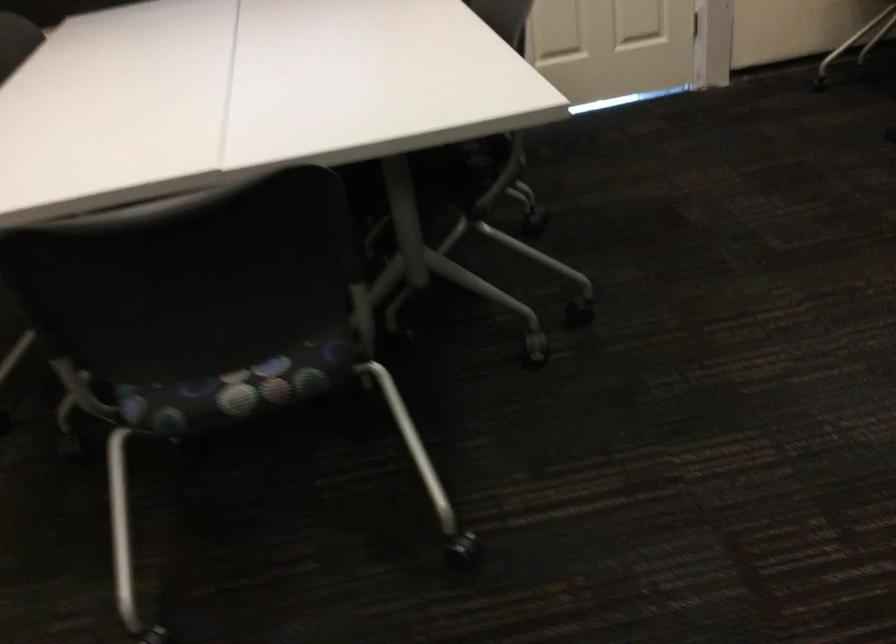
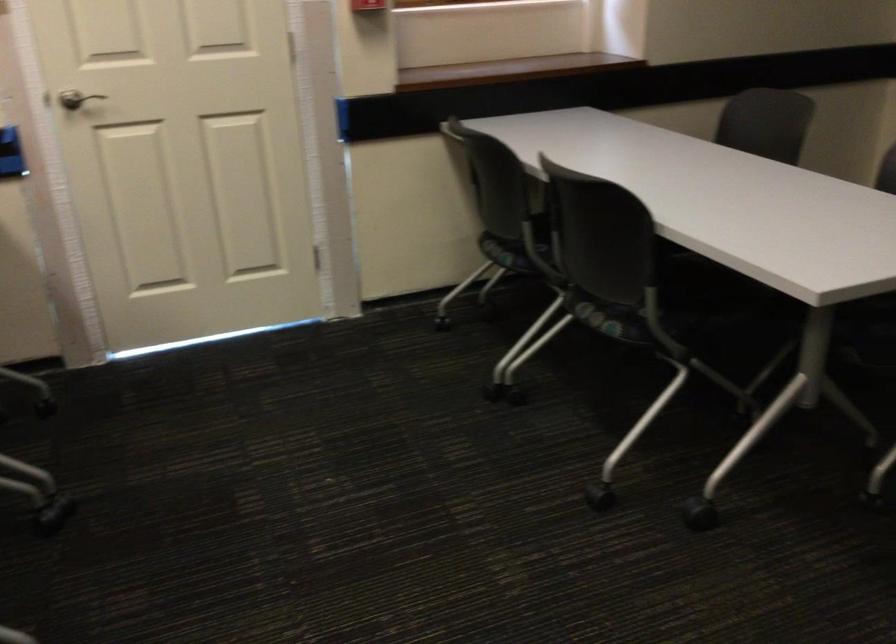
Question: Based on the continuous images, in which direction is the camera rotating? Reply with the corresponding letter.

Choices:
 (A) Left
 (B) Right
 (C) Up
 (D) Down

Answer: (B)